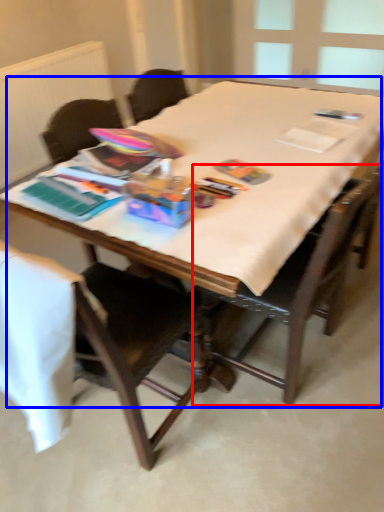
Question: Which object appears farthest to the camera in this image, chair (highlighted by a red box) or table (highlighted by a blue box)?

Choices:
 (A) chair
 (B) table

Answer: (B)